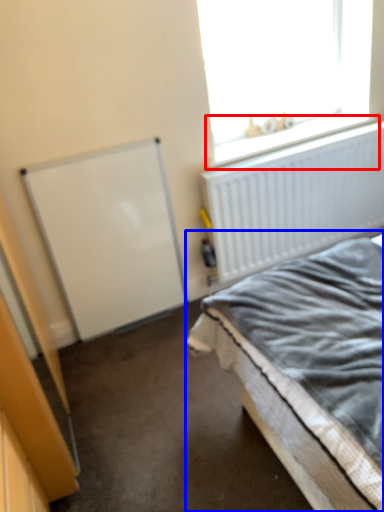
Question: Which point is closer to the camera, window sill (highlighted by a red box) or bed (highlighted by a blue box)?

Choices:
 (A) window sill
 (B) bed

Answer: (B)